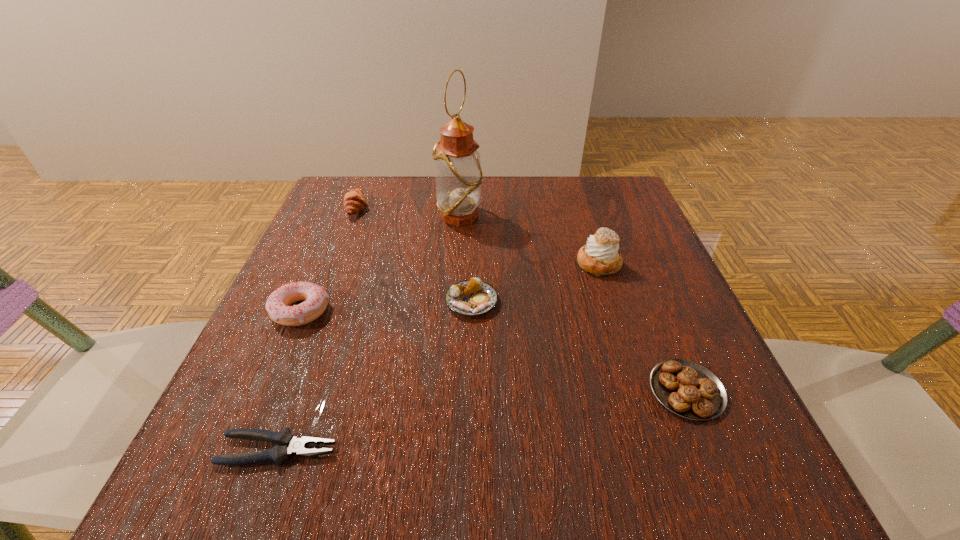
Find the location of a particular element. Image resolution: width=960 pixels, height=540 pixels. oil lamp is located at coordinates [x=458, y=171].

At what (x,y) coordinates should I click in order to perform the action: click on the tallest pastry. Please return your answer as a coordinate pair (x, y). The height and width of the screenshot is (540, 960). Looking at the image, I should click on (600, 256).

At what (x,y) coordinates should I click in order to perform the action: click on the second farthest pastry. Please return your answer as a coordinate pair (x, y). Looking at the image, I should click on (600, 256).

Where is `the third shortest pastry`? The image size is (960, 540). the third shortest pastry is located at coordinates (354, 201).

You are a GUI agent. You are given a task and a screenshot of the screen. Output one action in this format:
    pyautogui.click(x=<x>, y=<y>)
    Task: Click on the farthest pastry
    The image size is (960, 540).
    Given the screenshot: What is the action you would take?
    pyautogui.click(x=354, y=201)

Identify the location of doughnut. The image size is (960, 540). (278, 303).

Locate an element on the screen. the second nearest pastry is located at coordinates (471, 298).

This screenshot has height=540, width=960. Find the location of `the second nearest object`. the second nearest object is located at coordinates [x=686, y=388].

The image size is (960, 540). Find the location of `pliers`. pliers is located at coordinates (289, 445).

Locate an element on the screen. the shortest object is located at coordinates (x=289, y=445).